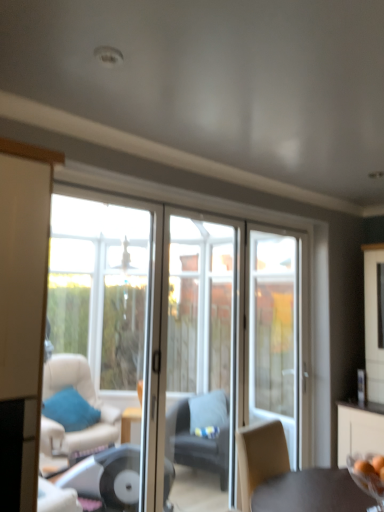
Question: From a real-world perspective, does clear glass screen door at center, marked as the second screen door in a right-to-left arrangement, stand above blue fabric pillow at lower left?

Choices:
 (A) no
 (B) yes

Answer: (B)

Question: Is clear glass screen door at center, which is the first screen door from left to right, positioned in front of blue fabric pillow at lower left?

Choices:
 (A) yes
 (B) no

Answer: (A)

Question: Is clear glass screen door at center, marked as the second screen door in a right-to-left arrangement, outside blue fabric pillow at lower left?

Choices:
 (A) yes
 (B) no

Answer: (A)

Question: Is clear glass screen door at center, which is the first screen door from left to right, smaller than blue fabric pillow at lower left?

Choices:
 (A) no
 (B) yes

Answer: (A)

Question: Can you confirm if clear glass screen door at center, marked as the second screen door in a right-to-left arrangement, is wider than blue fabric pillow at lower left?

Choices:
 (A) no
 (B) yes

Answer: (A)

Question: Is clear glass screen door at center, which is the first screen door from left to right, behind blue fabric pillow at lower left?

Choices:
 (A) yes
 (B) no

Answer: (B)

Question: Is blue fabric pillow at lower left outside dark gray fabric chair at center?

Choices:
 (A) no
 (B) yes

Answer: (B)

Question: From a real-world perspective, is blue fabric pillow at lower left below dark gray fabric chair at center?

Choices:
 (A) no
 (B) yes

Answer: (A)

Question: Is blue fabric pillow at lower left directly adjacent to dark gray fabric chair at center?

Choices:
 (A) no
 (B) yes

Answer: (A)

Question: Can you confirm if blue fabric pillow at lower left is thinner than dark gray fabric chair at center?

Choices:
 (A) no
 (B) yes

Answer: (B)

Question: Can you confirm if blue fabric pillow at lower left is wider than dark gray fabric chair at center?

Choices:
 (A) yes
 (B) no

Answer: (B)

Question: Considering the relative sizes of blue fabric pillow at lower left and dark gray fabric chair at center in the image provided, is blue fabric pillow at lower left taller than dark gray fabric chair at center?

Choices:
 (A) yes
 (B) no

Answer: (B)

Question: From a real-world perspective, is white glass door at center physically above blue fabric pillow at lower left?

Choices:
 (A) yes
 (B) no

Answer: (A)